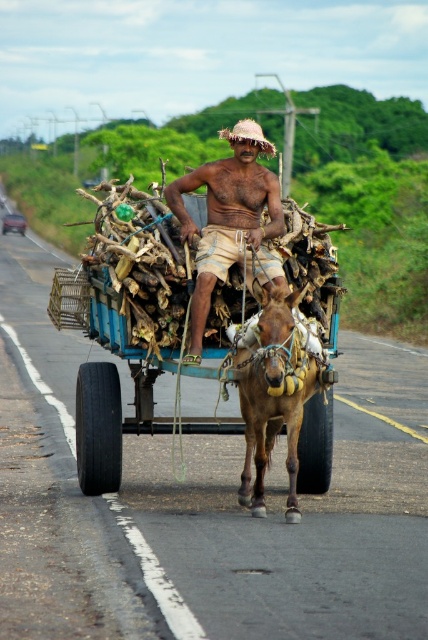
Question: Based on their relative distances, which object is farther from the brown textured shorts at center?

Choices:
 (A) blue painted wood horse cart at center
 (B) brown leather donkey at center

Answer: (A)

Question: Does blue painted wood horse cart at center appear under brown leather donkey at center?

Choices:
 (A) no
 (B) yes

Answer: (A)

Question: Estimate the real-world distances between objects in this image. Which object is closer to the brown textured shorts at center?

Choices:
 (A) blue painted wood horse cart at center
 (B) brown leather donkey at center

Answer: (B)

Question: Does blue painted wood horse cart at center appear under brown textured shorts at center?

Choices:
 (A) no
 (B) yes

Answer: (A)

Question: Can you confirm if blue painted wood horse cart at center is positioned below brown textured shorts at center?

Choices:
 (A) yes
 (B) no

Answer: (B)

Question: Which point is closer to the camera?

Choices:
 (A) (270, 323)
 (B) (175, 204)
 (C) (335, 296)

Answer: (A)